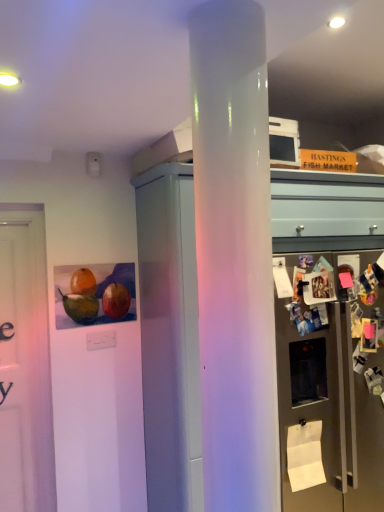
Question: Is satin silver refrigerator at right at the right side of white paper at lower right?

Choices:
 (A) yes
 (B) no

Answer: (A)

Question: Is satin silver refrigerator at right positioned with its back to white paper at lower right?

Choices:
 (A) no
 (B) yes

Answer: (B)

Question: Are satin silver refrigerator at right and white paper at lower right located far from each other?

Choices:
 (A) yes
 (B) no

Answer: (B)

Question: From the image's perspective, does satin silver refrigerator at right appear higher than white paper at lower right?

Choices:
 (A) no
 (B) yes

Answer: (B)

Question: Is satin silver refrigerator at right positioned before white paper at lower right?

Choices:
 (A) yes
 (B) no

Answer: (A)

Question: Is satin silver refrigerator at right placed right next to white paper at lower right?

Choices:
 (A) yes
 (B) no

Answer: (B)

Question: From the image's perspective, does white glossy cabinet at center appear higher than white paper at lower right?

Choices:
 (A) no
 (B) yes

Answer: (B)

Question: Can you confirm if white glossy cabinet at center is taller than white paper at lower right?

Choices:
 (A) no
 (B) yes

Answer: (B)

Question: From the image's perspective, is white glossy cabinet at center located beneath white paper at lower right?

Choices:
 (A) yes
 (B) no

Answer: (B)

Question: Are white glossy cabinet at center and white paper at lower right located far from each other?

Choices:
 (A) no
 (B) yes

Answer: (A)

Question: Can you confirm if white glossy cabinet at center is shorter than white paper at lower right?

Choices:
 (A) no
 (B) yes

Answer: (A)

Question: Is white glossy cabinet at center placed right next to white paper at lower right?

Choices:
 (A) yes
 (B) no

Answer: (B)

Question: Is white glossy cabinet at center thinner than satin silver refrigerator at right?

Choices:
 (A) no
 (B) yes

Answer: (A)